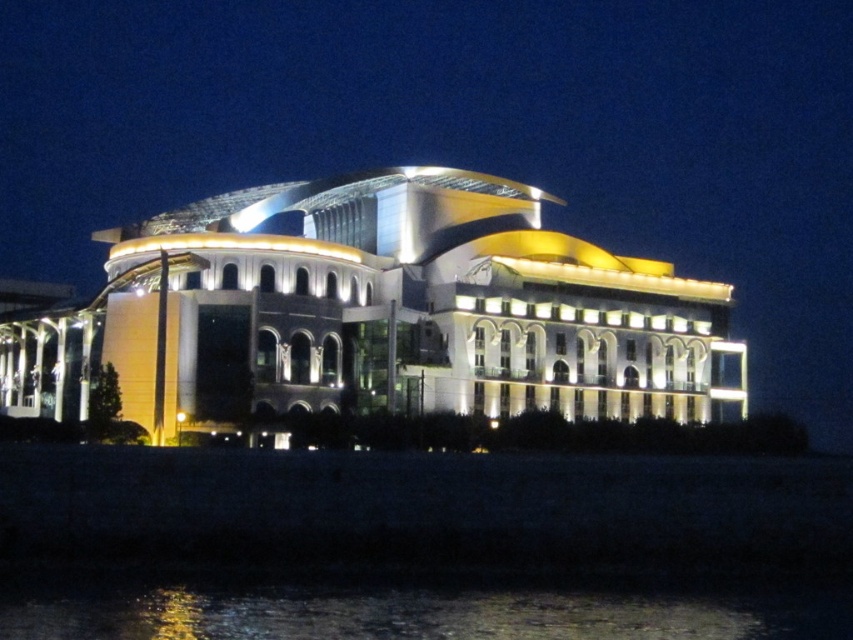
You are standing in front of the modern architectural structure at night. There is a point marked at coordinates point (376, 314). Which object does this point belong to?

The point (376, 314) is on white glossy building at center.

You are a photographer standing on a bridge that is 10 meters away from the white glossy building at center. You want to capture a reflection of the building in the glistening water at lower center. Is the building reflected in the water?

The white glossy building at center is positioned over glistening water at lower center, so yes, the building is reflected in the water because it is directly above the water surface.

You are a photographer standing at the edge of a lake, aiming to capture the white glossy building at center and the glistening water at lower center in your shot. Based on their positions, which object should appear closer to the camera in your photograph?

The white glossy building at center appears closer to the camera because it is in front of the glistening water at lower center.